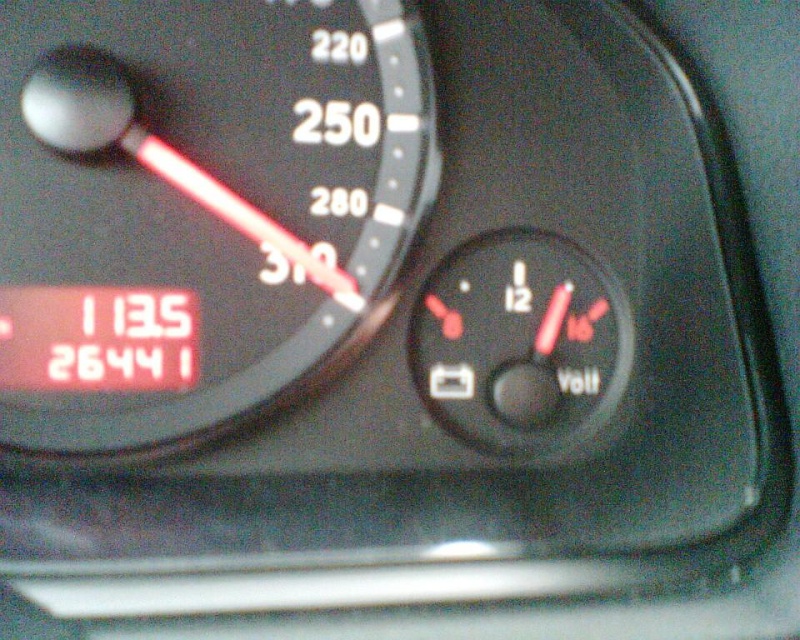
Question: Observing the image, what is the correct spatial positioning of black plastic speedometer at upper left in reference to black plastic voltmeter at center?

Choices:
 (A) above
 (B) below

Answer: (A)

Question: Among these objects, which one is farthest from the camera?

Choices:
 (A) black plastic speedometer at upper left
 (B) black plastic voltmeter at center

Answer: (B)

Question: Can you confirm if black plastic speedometer at upper left is thinner than black plastic voltmeter at center?

Choices:
 (A) no
 (B) yes

Answer: (A)

Question: Is black plastic speedometer at upper left above black plastic voltmeter at center?

Choices:
 (A) yes
 (B) no

Answer: (A)

Question: Which point is farther to the camera?

Choices:
 (A) (212, 435)
 (B) (441, 353)

Answer: (B)

Question: Which object appears closest to the camera in this image?

Choices:
 (A) black plastic voltmeter at center
 (B) black plastic speedometer at upper left

Answer: (B)